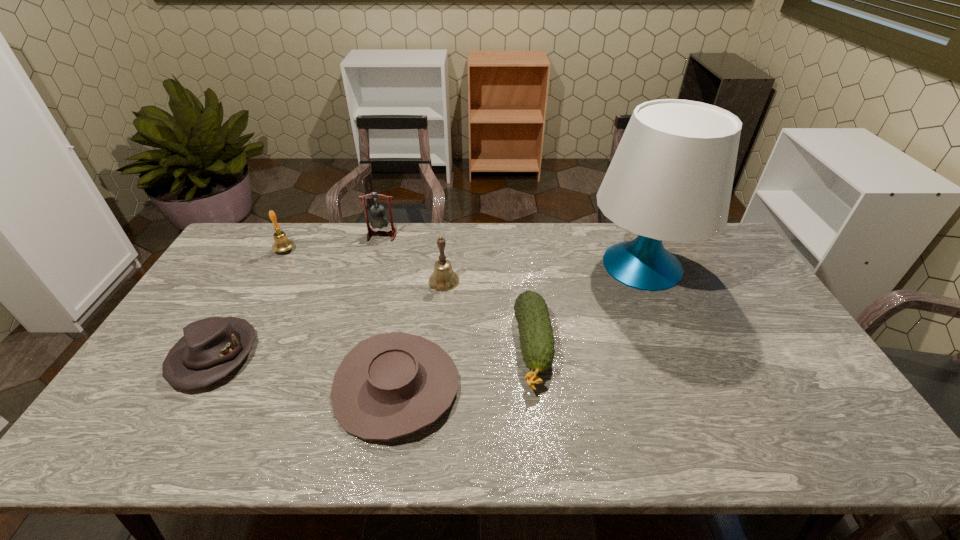
Locate an element on the screen. This screenshot has width=960, height=540. bell that stands as the third closest to the hat is located at coordinates (443, 278).

I want to click on the closest bell to the leftmost bell, so pyautogui.click(x=379, y=220).

You are a GUI agent. You are given a task and a screenshot of the screen. Output one action in this format:
    pyautogui.click(x=<x>, y=<y>)
    Task: Click on the vacant space that satisfies the following two spatial constraints: 1. on the front-facing side of the rightmost object; 2. on the decorative side of the hat
    
    Given the screenshot: What is the action you would take?
    pyautogui.click(x=681, y=356)

This screenshot has width=960, height=540. I want to click on free location that satisfies the following two spatial constraints: 1. on the back side of the cowboy hat; 2. on the right side of the nearest bell, so click(x=414, y=281).

Image resolution: width=960 pixels, height=540 pixels. Find the location of `free space that satisfies the following two spatial constraints: 1. on the front-facing side of the rightmost object; 2. at the blossom end of the cucumber`. free space that satisfies the following two spatial constraints: 1. on the front-facing side of the rightmost object; 2. at the blossom end of the cucumber is located at coordinates (678, 347).

Image resolution: width=960 pixels, height=540 pixels. I want to click on blank space that satisfies the following two spatial constraints: 1. on the front-facing side of the tallest object; 2. on the decorative side of the hat, so click(x=681, y=356).